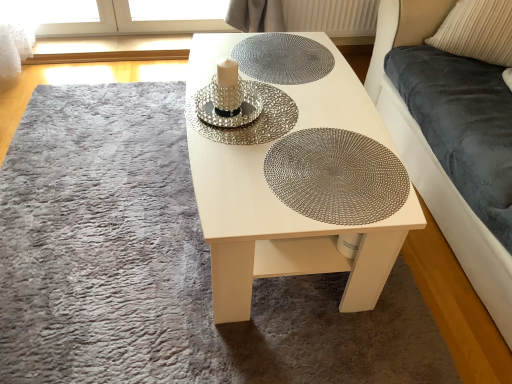
Question: Which direction should I rotate to look at silver metallic plate at center, arranged as the second glass plate when ordered from the bottom, — up or down?

Choices:
 (A) up
 (B) down

Answer: (A)

Question: Are velvet dark blue couch at right and beige corduroy pillow at upper right making contact?

Choices:
 (A) yes
 (B) no

Answer: (B)

Question: Does velvet dark blue couch at right have a larger size compared to beige corduroy pillow at upper right?

Choices:
 (A) no
 (B) yes

Answer: (B)

Question: Would you say velvet dark blue couch at right is a long distance from beige corduroy pillow at upper right?

Choices:
 (A) yes
 (B) no

Answer: (B)

Question: Can you confirm if velvet dark blue couch at right is positioned to the left of beige corduroy pillow at upper right?

Choices:
 (A) yes
 (B) no

Answer: (B)

Question: Could you tell me if velvet dark blue couch at right is turned towards beige corduroy pillow at upper right?

Choices:
 (A) yes
 (B) no

Answer: (A)

Question: From a real-world perspective, is velvet dark blue couch at right over beige corduroy pillow at upper right?

Choices:
 (A) no
 (B) yes

Answer: (A)

Question: From a real-world perspective, is metallic woven placemat at center, marked as the 1th glass plate in a bottom-to-top arrangement, under white wood table at center?

Choices:
 (A) yes
 (B) no

Answer: (B)

Question: Are metallic woven placemat at center, placed as the third glass plate when sorted from top to bottom, and white wood table at center beside each other?

Choices:
 (A) no
 (B) yes

Answer: (A)

Question: Considering the relative positions of metallic woven placemat at center, placed as the third glass plate when sorted from top to bottom, and white wood table at center in the image provided, is metallic woven placemat at center, placed as the third glass plate when sorted from top to bottom, to the right of white wood table at center from the viewer's perspective?

Choices:
 (A) yes
 (B) no

Answer: (A)

Question: Can you confirm if metallic woven placemat at center, marked as the 1th glass plate in a bottom-to-top arrangement, is taller than white wood table at center?

Choices:
 (A) no
 (B) yes

Answer: (A)

Question: Can you confirm if metallic woven placemat at center, placed as the third glass plate when sorted from top to bottom, is wider than white wood table at center?

Choices:
 (A) no
 (B) yes

Answer: (A)

Question: Is white wood table at center inside metallic woven placemat at center, placed as the third glass plate when sorted from top to bottom?

Choices:
 (A) yes
 (B) no

Answer: (B)

Question: Does white wood table at center have a greater height compared to beige corduroy pillow at upper right?

Choices:
 (A) no
 (B) yes

Answer: (B)